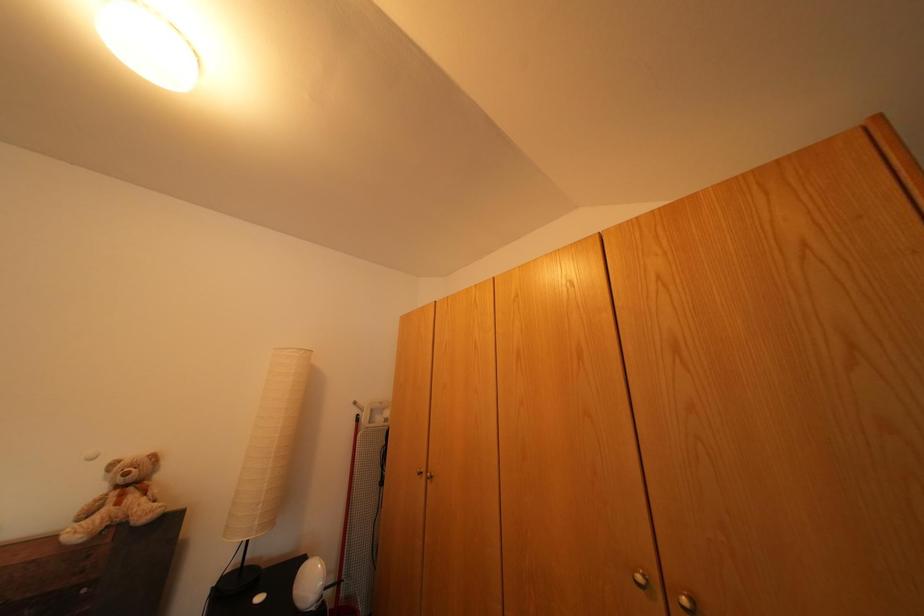
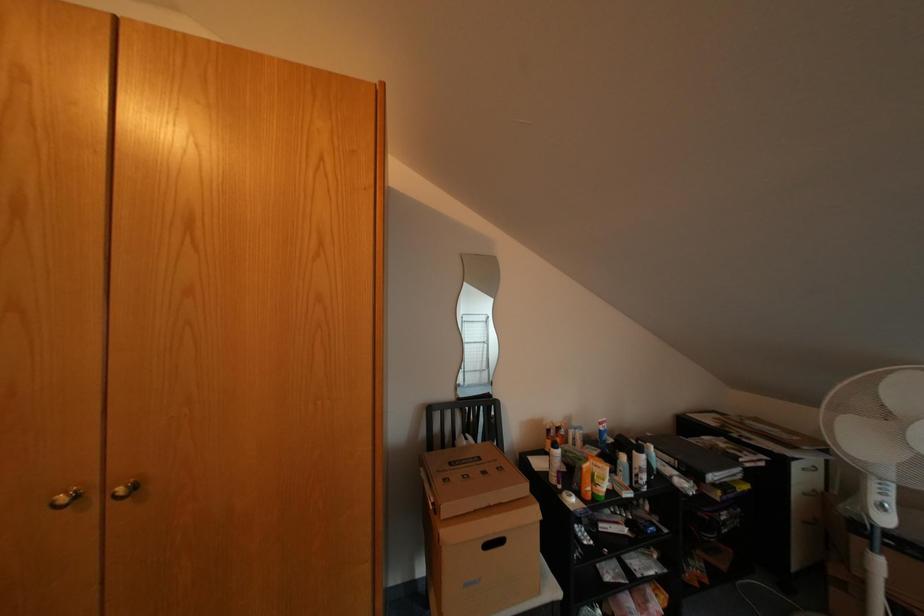
Question: The camera is either moving clockwise (left) or counter-clockwise (right) around the object. The first image is from the beginning of the video and the second image is from the end. Is the camera moving left or right when shooting the video?

Choices:
 (A) Left
 (B) Right

Answer: (A)